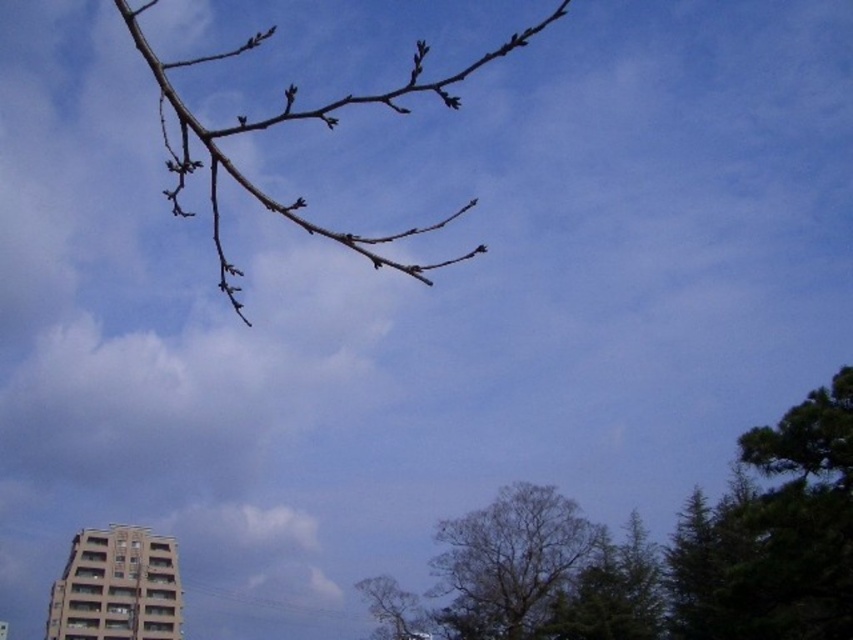
Question: Does brown textured tree at center appear on the right side of bare branches at upper center?

Choices:
 (A) no
 (B) yes

Answer: (B)

Question: Is brown textured tree at center in front of bare branches at upper center?

Choices:
 (A) yes
 (B) no

Answer: (B)

Question: Which of the following is the closest to the observer?

Choices:
 (A) (444, 621)
 (B) (444, 561)

Answer: (B)

Question: Considering the real-world distances, which object is closest to the bare branches at upper center?

Choices:
 (A) brown textured tree at center
 (B) green leafy tree at lower right

Answer: (A)

Question: Among these points, which one is farthest from the camera?

Choices:
 (A) (659, 563)
 (B) (502, 531)

Answer: (B)

Question: Does green leafy tree at lower right have a greater width compared to bare branches at upper center?

Choices:
 (A) yes
 (B) no

Answer: (B)